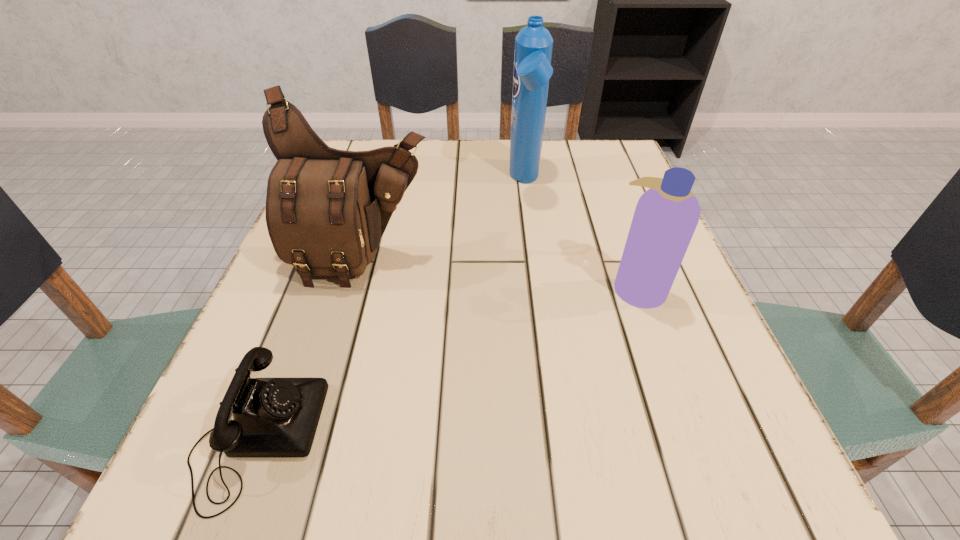
Locate an element on the screen. the left shampoo is located at coordinates (533, 44).

The width and height of the screenshot is (960, 540). I want to click on the farther shampoo, so click(533, 44).

I want to click on shoulder bag, so click(x=326, y=209).

At what (x,y) coordinates should I click in order to perform the action: click on the rightmost object. Please return your answer as a coordinate pair (x, y). The image size is (960, 540). Looking at the image, I should click on (666, 216).

Image resolution: width=960 pixels, height=540 pixels. In order to click on the right shampoo in this screenshot , I will do `click(666, 216)`.

The height and width of the screenshot is (540, 960). In order to click on the nearest object in this screenshot , I will do (x=272, y=417).

Where is `telephone`? The image size is (960, 540). telephone is located at coordinates [272, 417].

Where is `free space located 0.380m on the left of the taller shampoo`? The height and width of the screenshot is (540, 960). free space located 0.380m on the left of the taller shampoo is located at coordinates (350, 182).

This screenshot has height=540, width=960. What are the coordinates of `vacant position located 0.180m on the front-facing side of the shoulder bag` in the screenshot? It's located at (330, 374).

The width and height of the screenshot is (960, 540). Identify the location of free space located 0.060m on the left of the shorter shampoo. (577, 288).